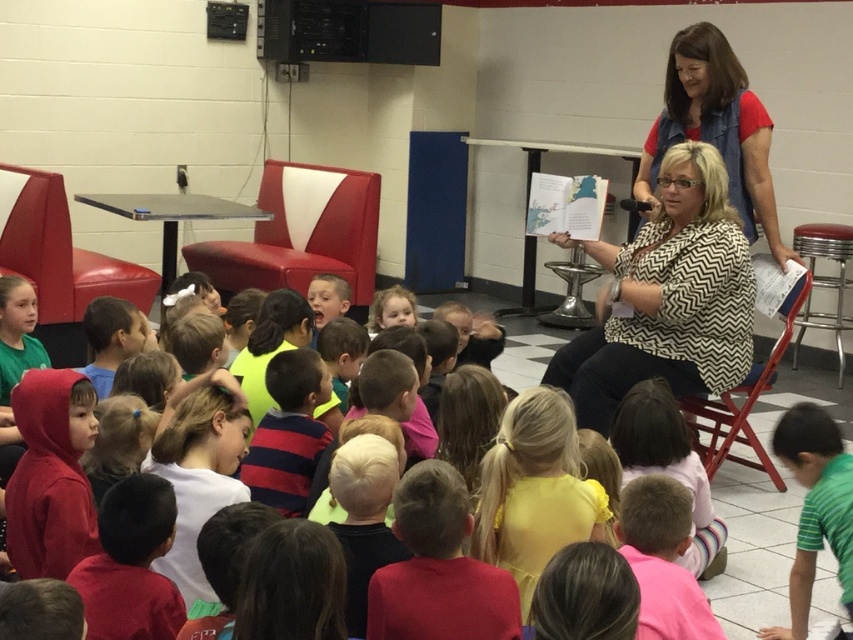
Does point (723, 49) come closer to viewer compared to point (689, 422)?

Yes, it is.

Does chevron-patterned blouse at center have a greater height compared to metallic red folding chair at center?

Yes, chevron-patterned blouse at center is taller than metallic red folding chair at center.

The height and width of the screenshot is (640, 853). What do you see at coordinates (715, 128) in the screenshot? I see `chevron-patterned blouse at center` at bounding box center [715, 128].

The width and height of the screenshot is (853, 640). I want to click on chevron-patterned blouse at center, so click(x=715, y=128).

Is green striped shirt at lower right to the right of metallic red folding chair at center from the viewer's perspective?

No, green striped shirt at lower right is not to the right of metallic red folding chair at center.

From the picture: Can you confirm if green striped shirt at lower right is positioned to the left of metallic red folding chair at center?

Correct, you'll find green striped shirt at lower right to the left of metallic red folding chair at center.

Describe the element at coordinates (815, 506) in the screenshot. This screenshot has height=640, width=853. I see `green striped shirt at lower right` at that location.

Find the location of `green striped shirt at lower right`. green striped shirt at lower right is located at coordinates (815, 506).

Who is higher up, red leather chair at center or metallic silver stool at right?

red leather chair at center is higher up.

Which is more to the left, red leather chair at center or metallic silver stool at right?

red leather chair at center is more to the left.

Which is in front, point (357, 284) or point (842, 323)?

Point (842, 323)

Locate an element on the screen. The width and height of the screenshot is (853, 640). red leather chair at center is located at coordinates [300, 234].